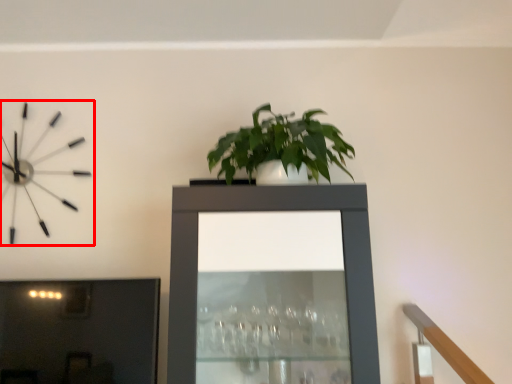
Question: From the image's perspective, where is wall clock (annotated by the red box) located relative to tv cabinet?

Choices:
 (A) below
 (B) above

Answer: (B)